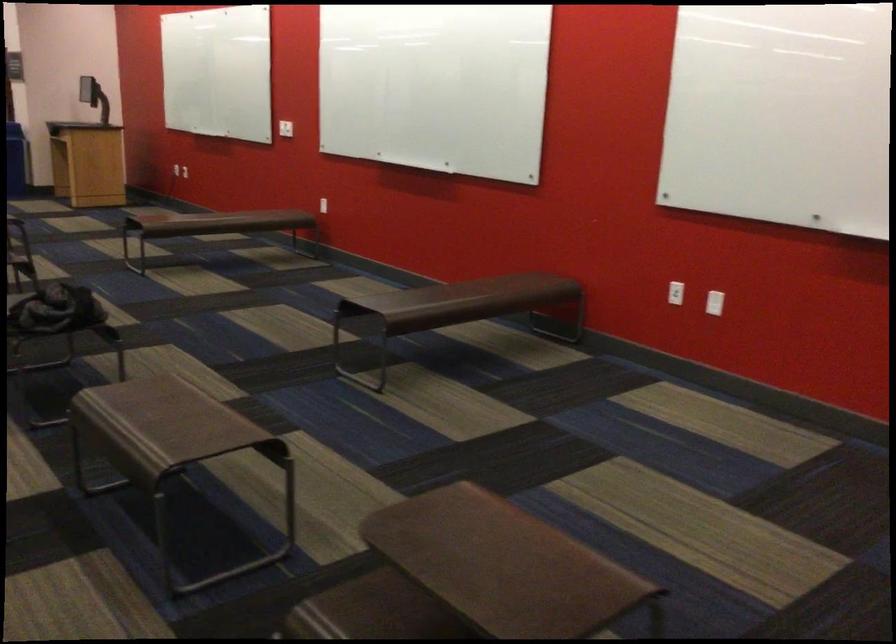
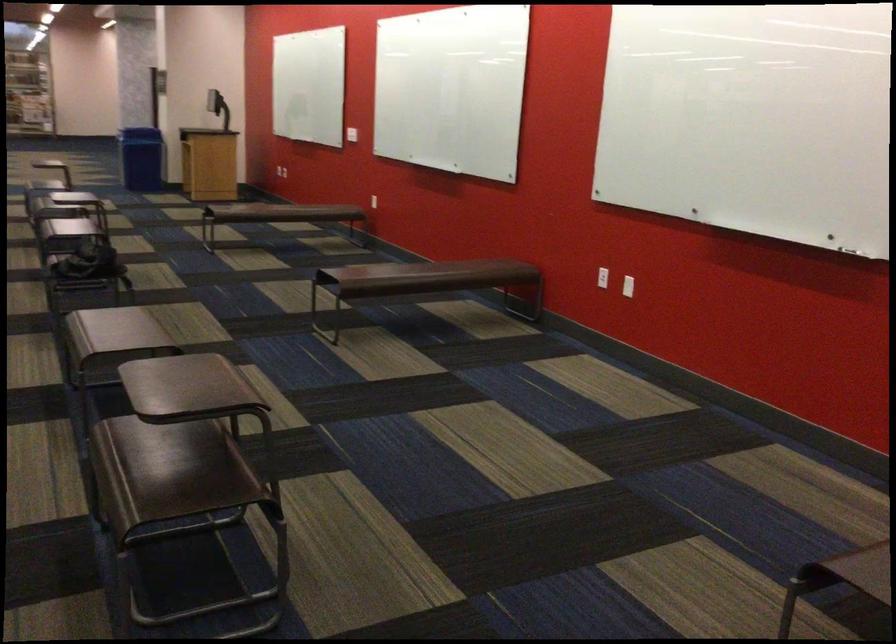
Where in the second image is the point corresponding to the point at 323,205 from the first image?

(381, 199)